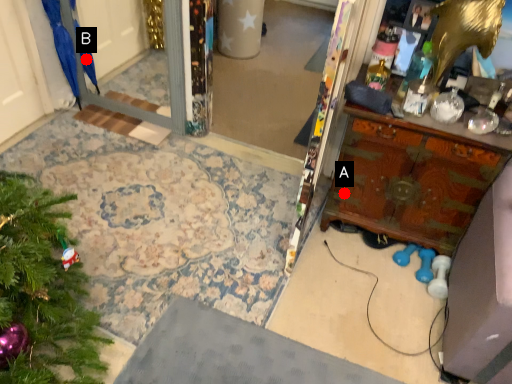
Question: Two points are circled on the image, labeled by A and B beside each circle. Among these points, which one is nearest to the camera?

Choices:
 (A) A is closer
 (B) B is closer

Answer: (A)